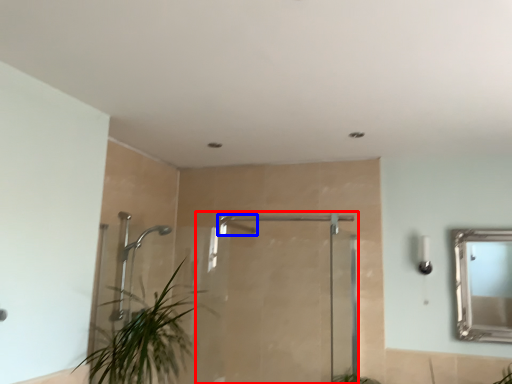
Question: Which point is closer to the camera, screen door (highlighted by a red box) or shower (highlighted by a blue box)?

Choices:
 (A) screen door
 (B) shower

Answer: (A)